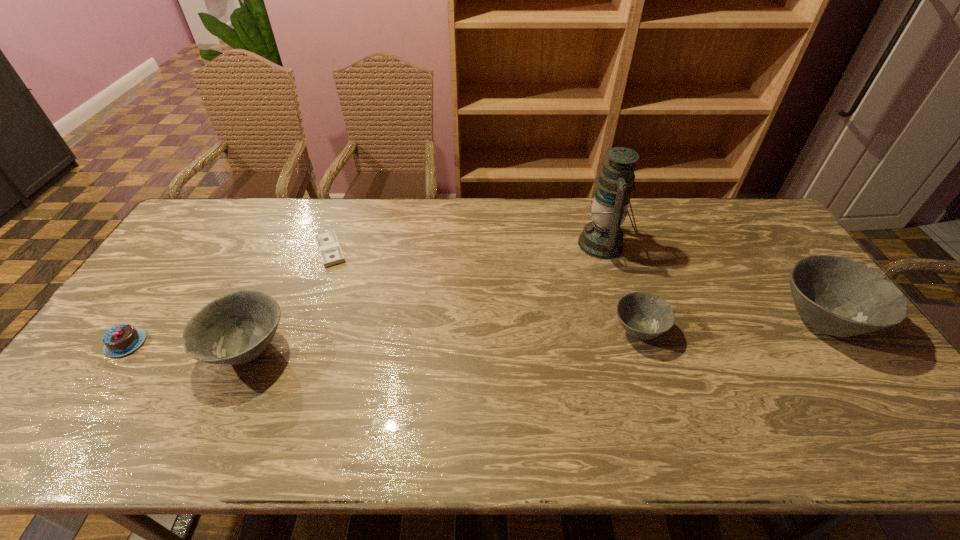
Find the location of `vacant area located on the left of the second bowl from left to right`. vacant area located on the left of the second bowl from left to right is located at coordinates (527, 330).

Locate an element on the screen. Image resolution: width=960 pixels, height=540 pixels. free space located on the front of the rightmost bowl is located at coordinates (865, 382).

Locate an element on the screen. The width and height of the screenshot is (960, 540). blank space located 0.230m on the front of the oil lamp is located at coordinates (628, 325).

Find the location of a particular element. vacant point located 0.170m on the left of the shortest object is located at coordinates [x=259, y=251].

Identify the location of blank space located 0.330m on the right of the second shortest object. This screenshot has width=960, height=540. (269, 343).

The height and width of the screenshot is (540, 960). I want to click on oil lamp that is at the far edge, so (602, 238).

Find the location of a particular element. Image resolution: width=960 pixels, height=540 pixels. dollar that is positioned at the far edge is located at coordinates (331, 253).

Where is `object situated at the near edge`? object situated at the near edge is located at coordinates (236, 328).

Identify the location of object that is at the left edge. This screenshot has height=540, width=960. (120, 340).

The width and height of the screenshot is (960, 540). In order to click on object at the right edge in this screenshot , I will do `click(840, 297)`.